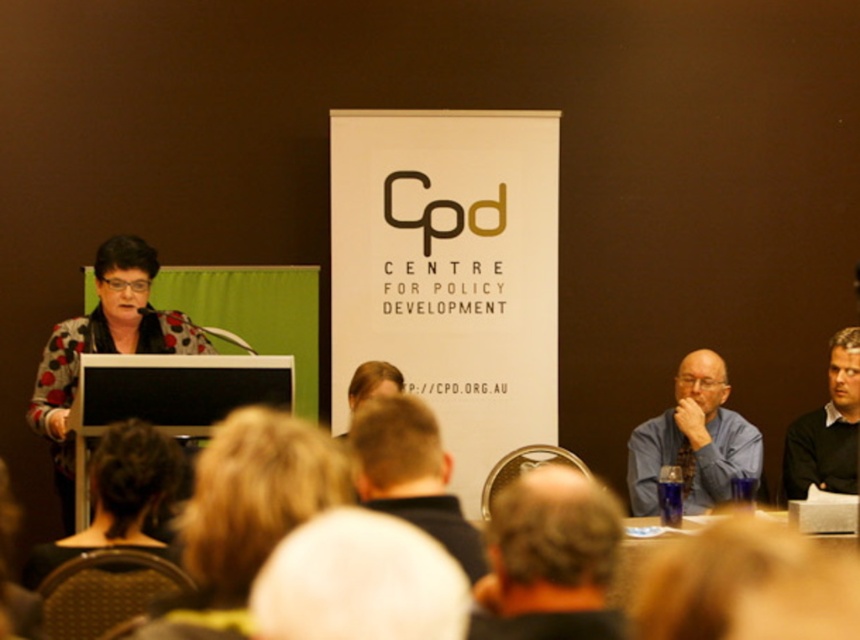
Does blue shirt at center have a larger size compared to dark green sweater at right?

Yes, blue shirt at center is bigger than dark green sweater at right.

Describe the element at coordinates (693, 440) in the screenshot. This screenshot has width=860, height=640. I see `blue shirt at center` at that location.

This screenshot has height=640, width=860. In order to click on blue shirt at center in this screenshot , I will do `click(693, 440)`.

Is blonde hair at center in front of smooth beige head at center?

No, blonde hair at center is further to the viewer.

Between point (280, 480) and point (286, 593), which one is positioned behind?

Positioned behind is point (280, 480).

Does point (234, 513) come closer to viewer compared to point (435, 541)?

Yes, point (234, 513) is in front of point (435, 541).

You are a GUI agent. You are given a task and a screenshot of the screen. Output one action in this format:
    pyautogui.click(x=<x>, y=<y>)
    Task: Click on the blonde hair at center
    Image resolution: width=860 pixels, height=640 pixels.
    Given the screenshot: What is the action you would take?
    pyautogui.click(x=244, y=515)

Based on the photo, can you confirm if blonde hair at center is positioned to the left of blurred hair at center?

Indeed, blonde hair at center is positioned on the left side of blurred hair at center.

Who is positioned more to the left, blonde hair at center or blurred hair at center?

blonde hair at center

Image resolution: width=860 pixels, height=640 pixels. What do you see at coordinates (244, 515) in the screenshot?
I see `blonde hair at center` at bounding box center [244, 515].

This screenshot has height=640, width=860. Find the location of `blonde hair at center`. blonde hair at center is located at coordinates (244, 515).